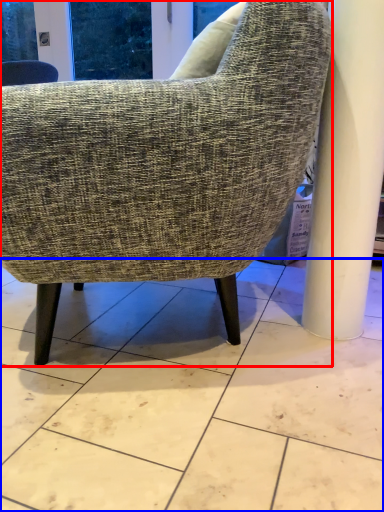
Question: Which of the following is the closest to the observer, chair (highlighted by a red box) or concrete (highlighted by a blue box)?

Choices:
 (A) chair
 (B) concrete

Answer: (B)